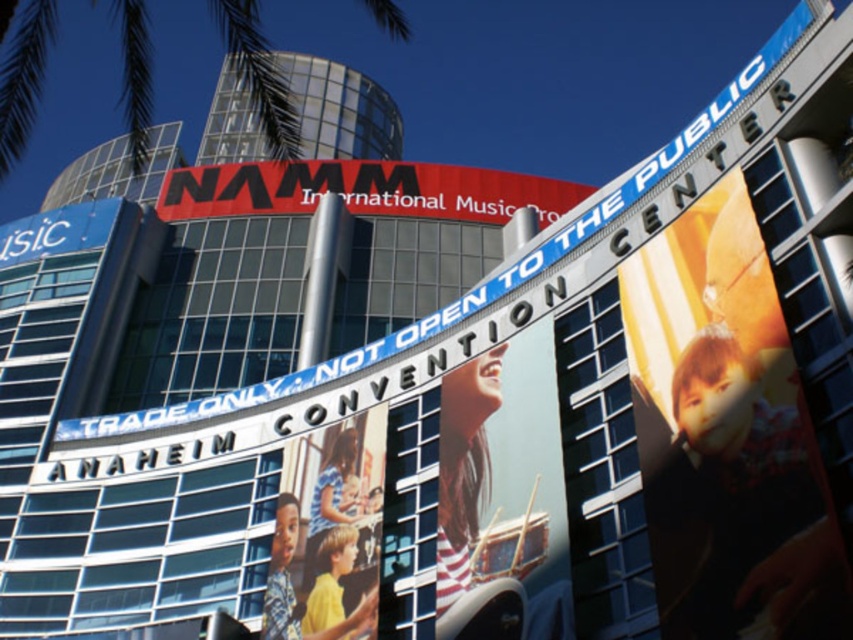
You are a visitor approaching the building and see the matte plastic children at center and the red matte sign at center. Which object is located to the right of the other?

The matte plastic children at center is positioned on the right side of red matte sign at center.

You are standing in front of the modern building with the NAMM signage. You notice a matte black guitar at center. Based on its coordinates, is the guitar positioned closer to the top or bottom of the image?

The matte black guitar at center is located at point 0.759 on the vertical axis, which places it closer to the bottom of the image since values closer to 1 are at the bottom.